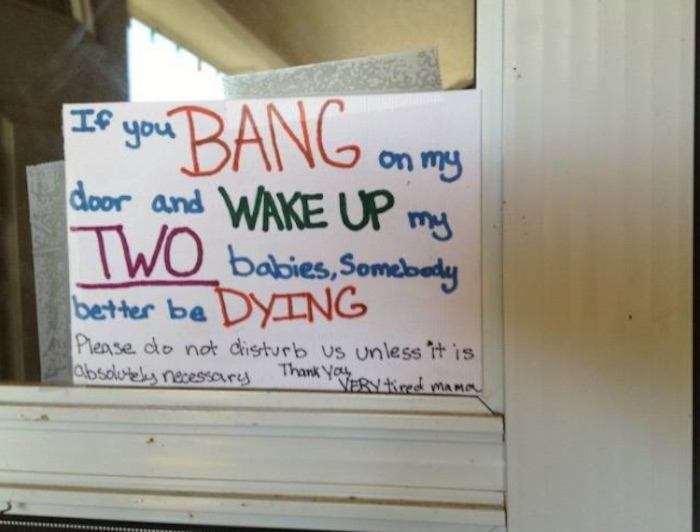
Locate an element on the screen. The image size is (700, 532). poster is located at coordinates (372, 192).